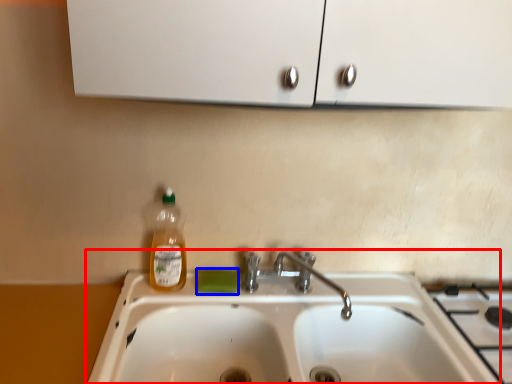
Question: Which of the following is the closest to the observer, sink (highlighted by a red box) or soap (highlighted by a blue box)?

Choices:
 (A) sink
 (B) soap

Answer: (A)